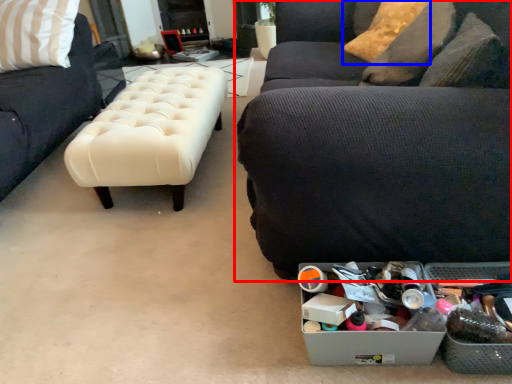
Question: Which object appears closest to the camera in this image, studio couch (highlighted by a red box) or pillow (highlighted by a blue box)?

Choices:
 (A) studio couch
 (B) pillow

Answer: (A)